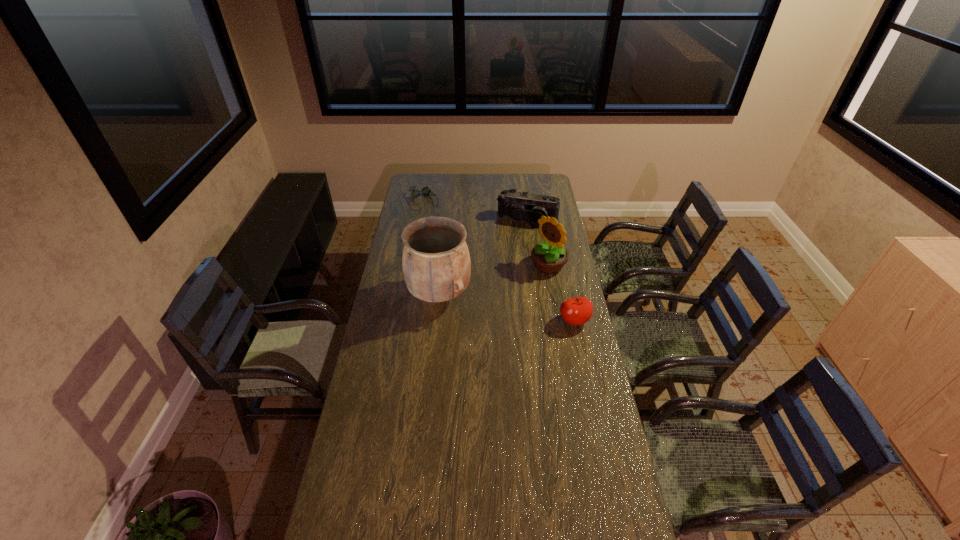
The height and width of the screenshot is (540, 960). What are the coordinates of `vacant position located on the face of the fourth shortest object` in the screenshot? It's located at (504, 293).

Find the location of a particular element. blank space located 0.340m on the face of the fourth shortest object is located at coordinates (483, 306).

The image size is (960, 540). Identify the location of vacant space located 0.280m on the face of the fourth shortest object. (493, 300).

You are a GUI agent. You are given a task and a screenshot of the screen. Output one action in this format:
    pyautogui.click(x=<x>, y=<y>)
    Task: Click on the vacant position located on the front-facing side of the spectacles
    
    Given the screenshot: What is the action you would take?
    click(449, 241)

The height and width of the screenshot is (540, 960). Identify the location of free space located on the front-facing side of the spectacles. (448, 239).

Find the location of `free space located 0.400m on the front-facing side of the spectacles`. free space located 0.400m on the front-facing side of the spectacles is located at coordinates (455, 249).

Image resolution: width=960 pixels, height=540 pixels. What are the coordinates of `object positioned at the far edge` in the screenshot? It's located at (425, 191).

The width and height of the screenshot is (960, 540). I want to click on urn located in the left edge section of the desktop, so click(436, 262).

Locate an element on the screen. spectacles that is at the left edge is located at coordinates (425, 191).

Where is `apple that is at the right edge`? The width and height of the screenshot is (960, 540). apple that is at the right edge is located at coordinates (575, 311).